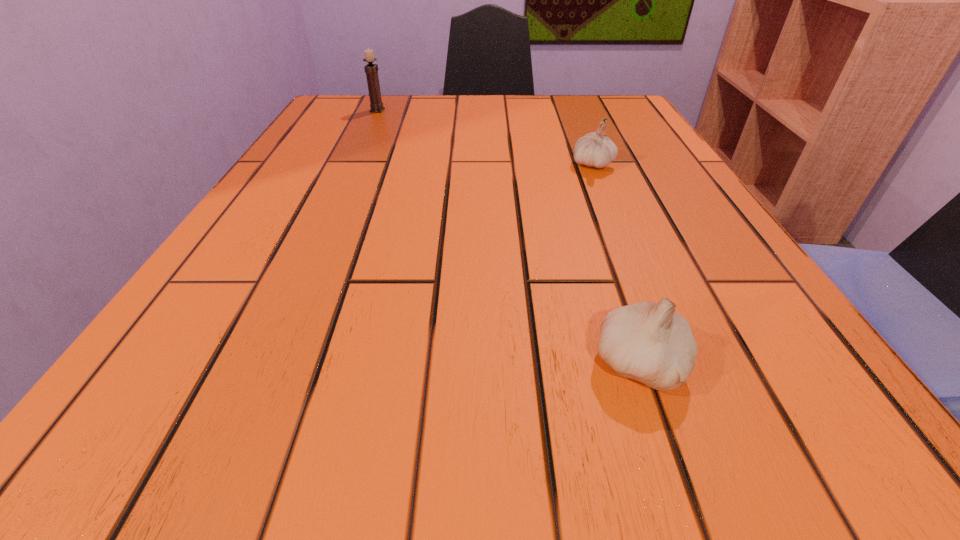
Locate an element on the screen. The height and width of the screenshot is (540, 960). free space between the nearest object and the second farthest object is located at coordinates (615, 265).

At what (x,y) coordinates should I click in order to perform the action: click on vacant area between the nearer garlic and the farthest object. Please return your answer as a coordinate pair (x, y). The image size is (960, 540). Looking at the image, I should click on (508, 238).

Identify the location of free spot between the farthest object and the farther garlic. This screenshot has width=960, height=540. (485, 137).

Identify the location of empty location between the second nearest object and the tallest object. This screenshot has width=960, height=540. (485, 137).

This screenshot has height=540, width=960. What are the coordinates of `unoccupied position between the candle holder and the second nearest object` in the screenshot? It's located at (485, 137).

Find the location of a particular element. free space between the second nearest object and the farthest object is located at coordinates (485, 137).

Image resolution: width=960 pixels, height=540 pixels. I want to click on free spot between the second farthest object and the nearest object, so click(615, 265).

The image size is (960, 540). Find the location of `vacant point located between the farther garlic and the tallest object`. vacant point located between the farther garlic and the tallest object is located at coordinates (485, 137).

The width and height of the screenshot is (960, 540). In order to click on blank region between the second farthest object and the nearest object in this screenshot , I will do `click(615, 265)`.

The height and width of the screenshot is (540, 960). Find the location of `vacant region between the nearer garlic and the tallest object`. vacant region between the nearer garlic and the tallest object is located at coordinates (508, 238).